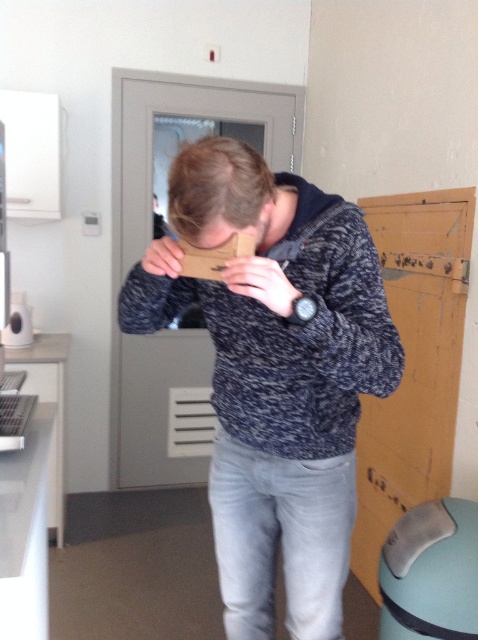
Question: Among these objects, which one is nearest to the camera?

Choices:
 (A) brown cardboard at center
 (B) matte wood face at center
 (C) matte cardboard at center

Answer: (A)

Question: Which of these objects is positioned farthest from the matte wood face at center?

Choices:
 (A) brown cardboard at center
 (B) matte cardboard at center
 (C) matte black watch at center
 (D) matte gray sweater at center

Answer: (D)

Question: Which point is farther to the camera?

Choices:
 (A) matte gray sweater at center
 (B) matte cardboard at center
 (C) matte wood face at center

Answer: (B)

Question: Is matte gray sweater at center positioned in front of matte cardboard at center?

Choices:
 (A) yes
 (B) no

Answer: (A)

Question: Is matte black watch at center below matte wood face at center?

Choices:
 (A) yes
 (B) no

Answer: (A)

Question: Does brown cardboard at center have a larger size compared to matte black watch at center?

Choices:
 (A) yes
 (B) no

Answer: (A)